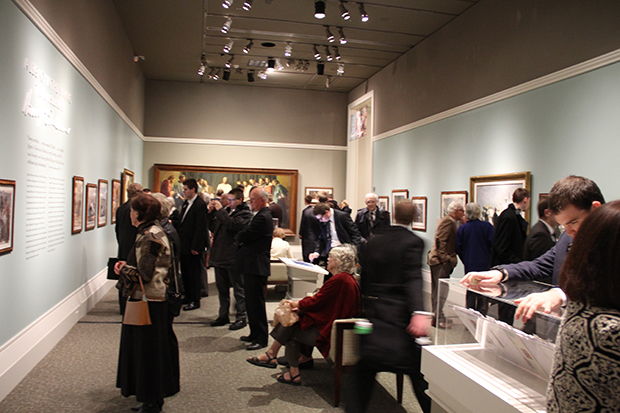
The height and width of the screenshot is (413, 620). I want to click on brown ceiling and upper walls, so 166,36, 412,23, 477,68, 118,71, 187,107.